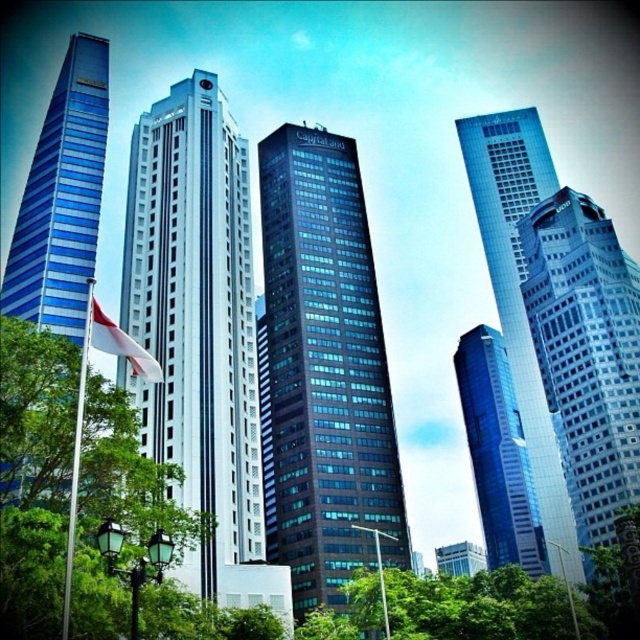
You are standing at the base of the CapitaLand building and want to take a photo of the point at coordinates point (45, 506). If your camera has a maximum zoom range of 100 feet, will you be able to capture the point in your photo?

The distance of point (45, 506) from camera is 118.39 feet, which exceeds the camera maximum zoom range of 100 feet. Therefore, you won not be able to capture the point in your photo.

You are standing at the point labeled as point (35, 472) in the image. What is the nearest object to you in the scene?

The nearest object to point (35, 472) is the green leafy tree at lower left since the point is located on it.

You are standing in the park area in front of the skyscrapers and want to take a photo that includes both the green leafy tree at lower left and the silver metallic flag pole at left. Which object will appear wider in the photo?

The silver metallic flag pole at left will appear wider in the photo because its width is greater than the green leafy tree at lower left.